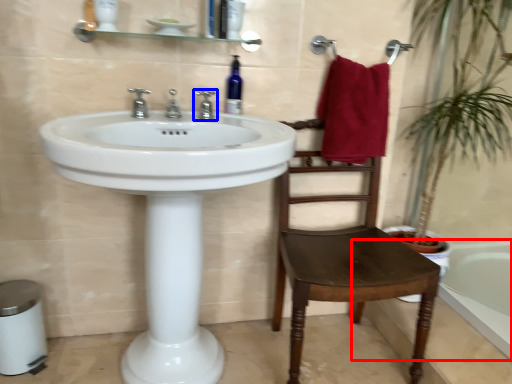
Question: Which object is closer to the camera taking this photo, bath (highlighted by a red box) or tap (highlighted by a blue box)?

Choices:
 (A) bath
 (B) tap

Answer: (A)